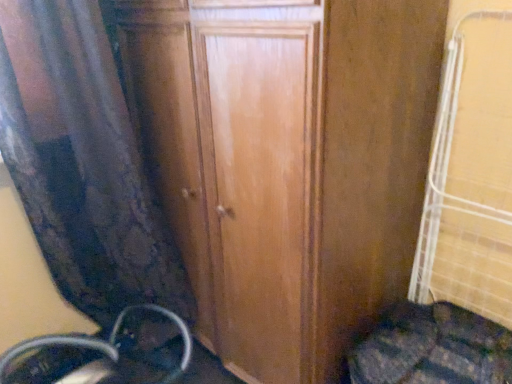
Question: Does wooden door at center appear on the left side of velvet curtain at left?

Choices:
 (A) no
 (B) yes

Answer: (A)

Question: Is wooden door at center far away from velvet curtain at left?

Choices:
 (A) no
 (B) yes

Answer: (A)

Question: From a real-world perspective, is wooden door at center over velvet curtain at left?

Choices:
 (A) no
 (B) yes

Answer: (A)

Question: Is wooden door at center facing away from velvet curtain at left?

Choices:
 (A) no
 (B) yes

Answer: (A)

Question: Is wooden door at center wider than velvet curtain at left?

Choices:
 (A) no
 (B) yes

Answer: (B)

Question: Would you say metallic silver wheel at lower left is inside or outside velvet curtain at left?

Choices:
 (A) outside
 (B) inside

Answer: (B)

Question: In the image, is metallic silver wheel at lower left on the left side or the right side of velvet curtain at left?

Choices:
 (A) right
 (B) left

Answer: (B)

Question: In the image, is metallic silver wheel at lower left positioned in front of or behind velvet curtain at left?

Choices:
 (A) front
 (B) behind

Answer: (B)

Question: From their relative heights in the image, would you say metallic silver wheel at lower left is taller or shorter than velvet curtain at left?

Choices:
 (A) short
 (B) tall

Answer: (A)

Question: From a real-world perspective, is velvet curtain at left positioned above or below metallic silver wheel at lower left?

Choices:
 (A) above
 (B) below

Answer: (A)

Question: Looking at the image, does velvet curtain at left seem bigger or smaller compared to metallic silver wheel at lower left?

Choices:
 (A) small
 (B) big

Answer: (B)

Question: Considering the positions of velvet curtain at left and metallic silver wheel at lower left in the image, is velvet curtain at left taller or shorter than metallic silver wheel at lower left?

Choices:
 (A) tall
 (B) short

Answer: (A)

Question: From the image's perspective, relative to metallic silver wheel at lower left, is velvet curtain at left above or below?

Choices:
 (A) below
 (B) above

Answer: (B)

Question: Does point (413, 72) appear closer or farther from the camera than point (0, 369)?

Choices:
 (A) farther
 (B) closer

Answer: (B)

Question: Is wooden door at center spatially inside metallic silver wheel at lower left, or outside of it?

Choices:
 (A) inside
 (B) outside

Answer: (B)